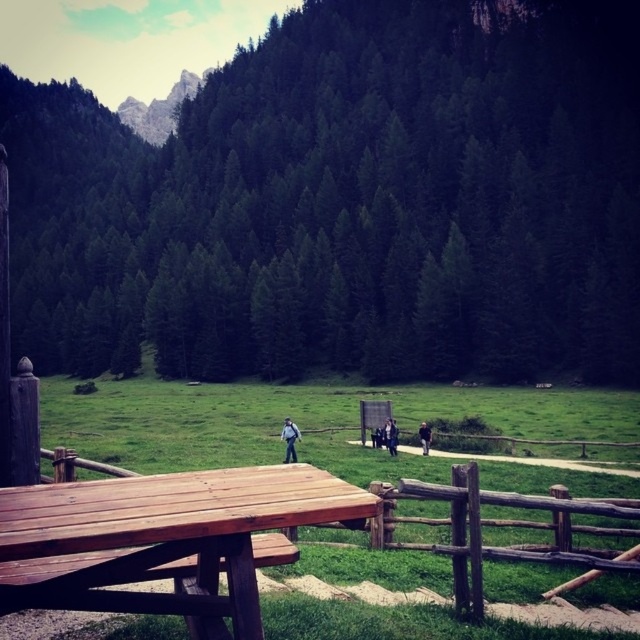
Which is behind, point (177, 109) or point (392, 433)?

Positioned behind is point (177, 109).

Is the position of rugged stone mountain at upper left less distant than that of dark blue fabric jacket at center?

No, it is not.

I want to click on rugged stone mountain at upper left, so click(160, 108).

Which is below, wooden picnic table at center or dark blue jeans at center?

dark blue jeans at center is below.

Does point (188, 611) lie in front of point (288, 445)?

Yes.

You are a GUI agent. You are given a task and a screenshot of the screen. Output one action in this format:
    pyautogui.click(x=<x>, y=<y>)
    Task: Click on the wooden picnic table at center
    The width and height of the screenshot is (640, 640).
    Given the screenshot: What is the action you would take?
    pyautogui.click(x=161, y=540)

Between point (284, 432) and point (385, 438), which one is positioned in front?

Positioned in front is point (284, 432).

Is dark blue jeans at center thinner than dark blue fabric jacket at center?

Incorrect, dark blue jeans at center's width is not less than dark blue fabric jacket at center's.

You are a GUI agent. You are given a task and a screenshot of the screen. Output one action in this format:
    pyautogui.click(x=<x>, y=<y>)
    Task: Click on the dark blue jeans at center
    This screenshot has height=640, width=640.
    Given the screenshot: What is the action you would take?
    pyautogui.click(x=289, y=440)